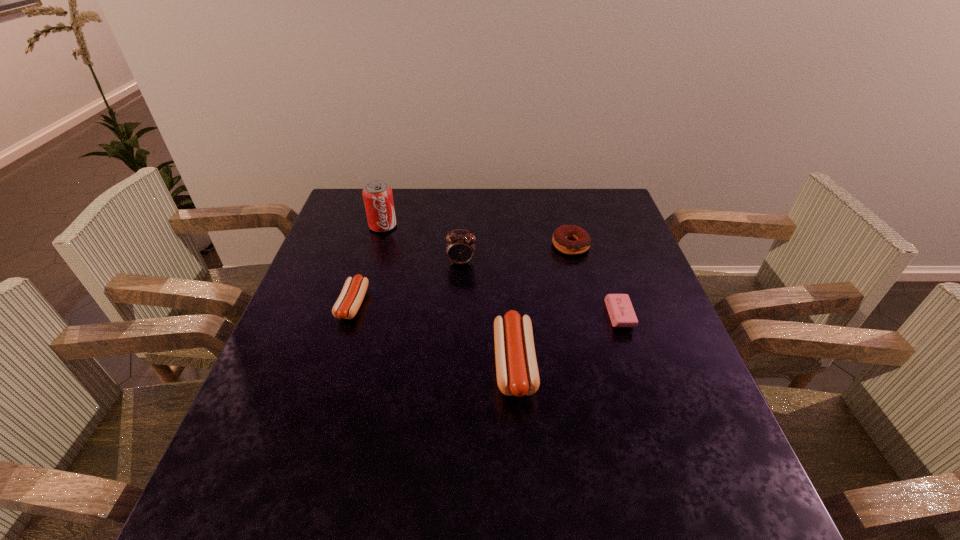
What are the coordinates of `empty space that is in between the fourth nearest object and the doughnut` in the screenshot? It's located at (516, 254).

Image resolution: width=960 pixels, height=540 pixels. In order to click on free space that is in between the farthest object and the shorter sausage in this screenshot , I will do `click(368, 265)`.

Find the location of a particular element. The image size is (960, 540). unoccupied area between the fourth object from right to left and the fourth shortest object is located at coordinates (488, 313).

Find the location of `free area in between the farthest object and the eraser`. free area in between the farthest object and the eraser is located at coordinates (501, 271).

Locate an element on the screen. The width and height of the screenshot is (960, 540). blank region between the alarm clock and the fifth nearest object is located at coordinates (516, 254).

Where is `blank region between the eraser and the alarm clock`? blank region between the eraser and the alarm clock is located at coordinates (540, 289).

Locate an element on the screen. The image size is (960, 540). free area in between the shorter sausage and the eraser is located at coordinates (486, 310).

Where is `object that can be found as the third closest to the second farthest object`? The image size is (960, 540). object that can be found as the third closest to the second farthest object is located at coordinates (517, 373).

Select which object appears as the closest to the second farthest object. Please provide its 2D coordinates. Your answer should be formatted as a tuple, i.e. [(x, y)], where the tuple contains the x and y coordinates of a point satisfying the conditions above.

[(620, 309)]

The width and height of the screenshot is (960, 540). Identify the location of free space that satisfies the following two spatial constraints: 1. on the front side of the farthest object; 2. on the right side of the shortest object. (357, 315).